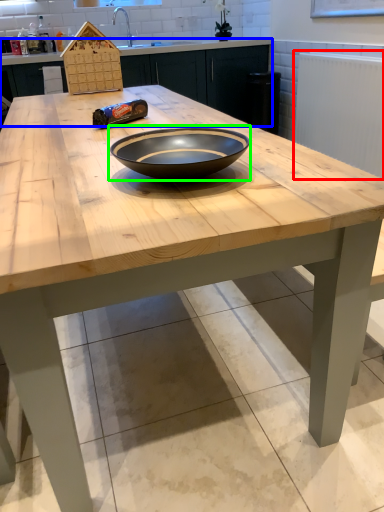
Question: Which is nearer to the radiator (highlighted by a red box)? cabinetry (highlighted by a blue box) or bowl (highlighted by a green box).

Choices:
 (A) cabinetry
 (B) bowl

Answer: (A)